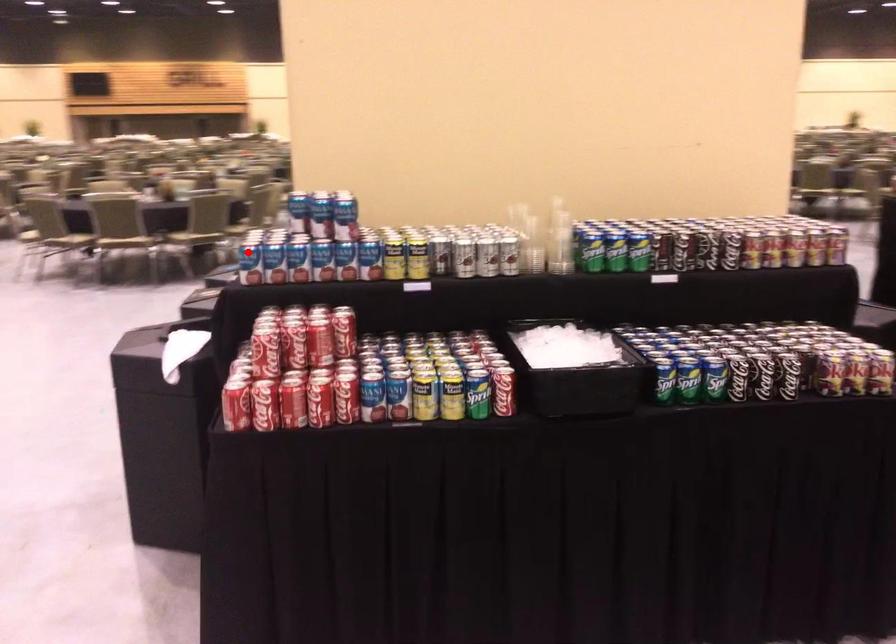
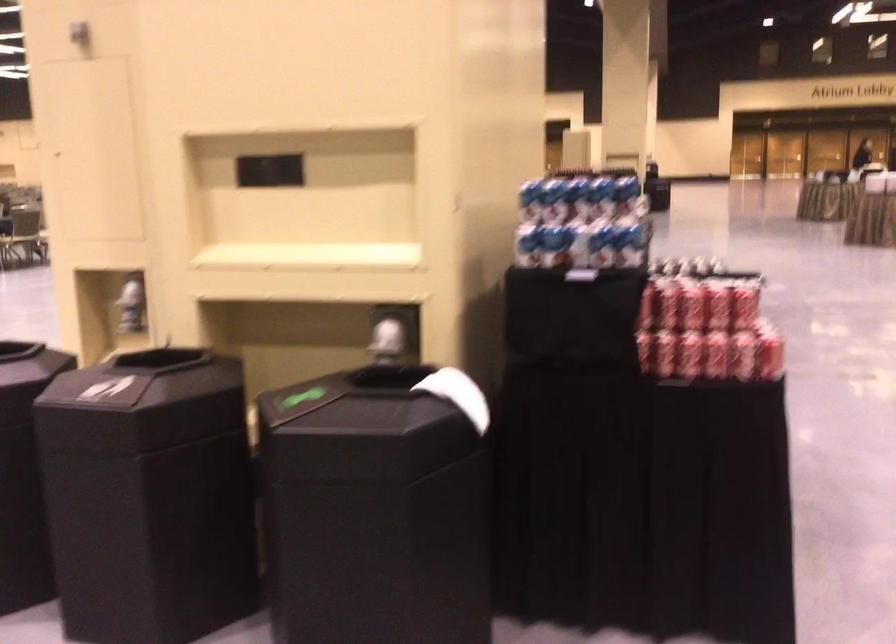
Locate, in the second image, the point that corresponds to the highlighted location in the first image.

(576, 247)